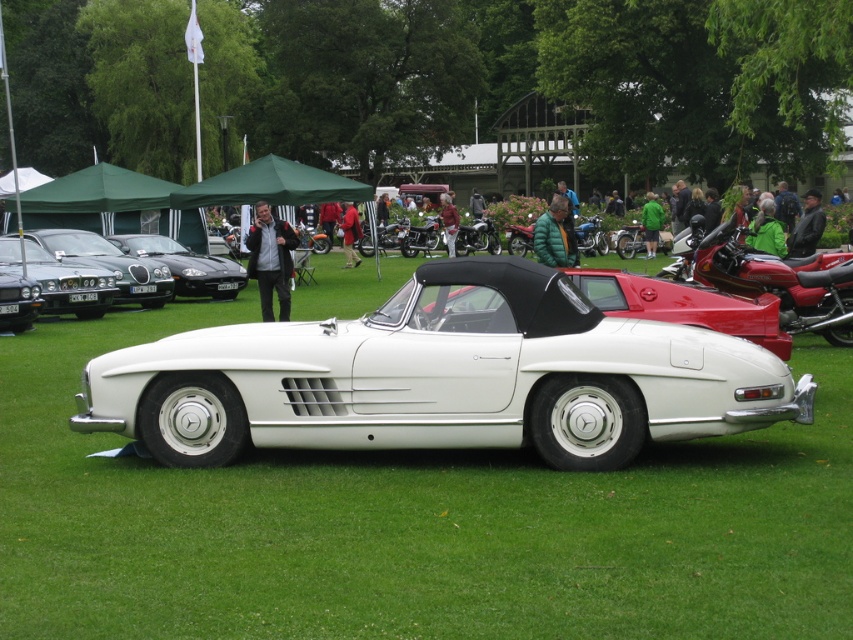
Who is lower down, shiny red motorcycle at right or shiny black car at left?

shiny red motorcycle at right is lower down.

Is shiny red motorcycle at right below shiny black car at left?

Indeed, shiny red motorcycle at right is positioned under shiny black car at left.

Is point (795, 321) positioned in front of point (65, 275)?

Yes, it is in front of point (65, 275).

Identify the location of shiny red motorcycle at right. The image size is (853, 640). (780, 284).

Does shiny black car at left appear on the right side of shiny black car at center?

In fact, shiny black car at left is to the left of shiny black car at center.

Is shiny black car at left shorter than shiny black car at center?

Indeed, shiny black car at left has a lesser height compared to shiny black car at center.

Where is `shiny black car at left`? shiny black car at left is located at coordinates (68, 284).

Is point (746, 250) closer to camera compared to point (173, 262)?

Yes, it is.

In the scene shown: Is shiny red motorcycle at right shorter than shiny black car at center?

Indeed, shiny red motorcycle at right has a lesser height compared to shiny black car at center.

Who is more forward, (811, 280) or (234, 292)?

Point (811, 280) is in front.

Identify the location of shiny red motorcycle at right. (780, 284).